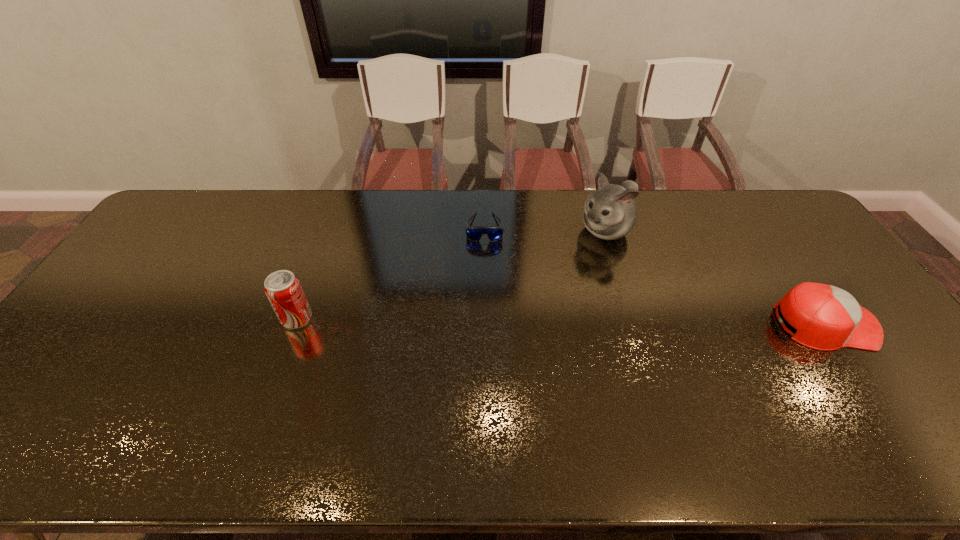
At what (x,y) coordinates should I click in order to perform the action: click on free space on the desktop that is between the soda can and the baseball cap and is positioned on the face of the second object from right to left. Please return your answer as a coordinate pair (x, y). Looking at the image, I should click on (501, 320).

Where is `free spot on the desktop that is between the soda can and the second shortest object and is positioned on the front-facing side of the shortest object`? free spot on the desktop that is between the soda can and the second shortest object and is positioned on the front-facing side of the shortest object is located at coordinates (486, 320).